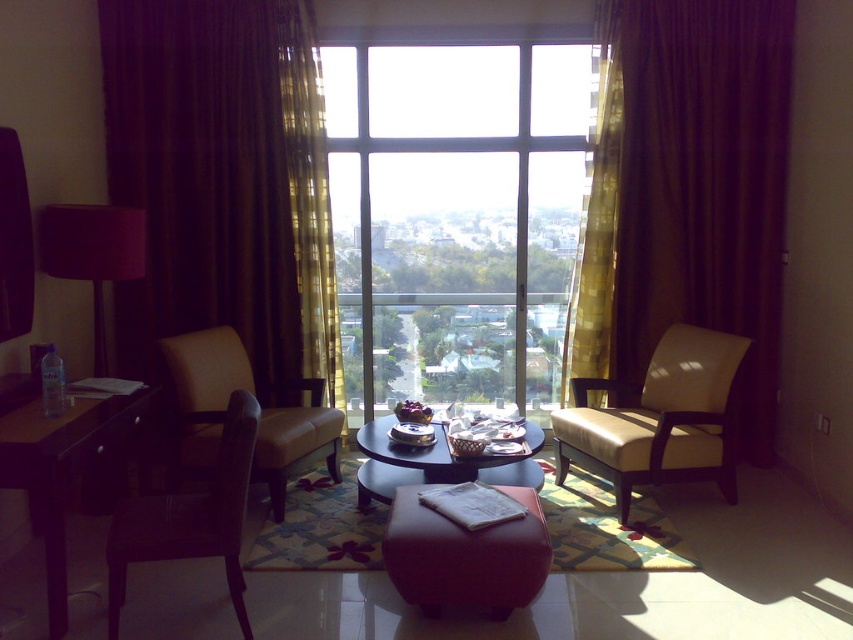
Image resolution: width=853 pixels, height=640 pixels. What do you see at coordinates (222, 180) in the screenshot?
I see `brown sheer curtain at left` at bounding box center [222, 180].

Which of these two, brown sheer curtain at left or matte black lampshade at left, stands shorter?

Standing shorter between the two is matte black lampshade at left.

Between point (318, 266) and point (84, 253), which one is positioned in front?

Point (84, 253)

Identify the location of brown sheer curtain at left. Image resolution: width=853 pixels, height=640 pixels. (222, 180).

Does brown sheer curtain at right appear over brown wooden table at left?

Yes.

What do you see at coordinates (689, 189) in the screenshot?
I see `brown sheer curtain at right` at bounding box center [689, 189].

Does point (671, 38) come closer to viewer compared to point (33, 442)?

No.

Locate an element on the screen. brown sheer curtain at right is located at coordinates (689, 189).

Is transparent glass window at center below brown sheer curtain at left?

Yes, transparent glass window at center is below brown sheer curtain at left.

Where is `transparent glass window at center`? transparent glass window at center is located at coordinates (454, 218).